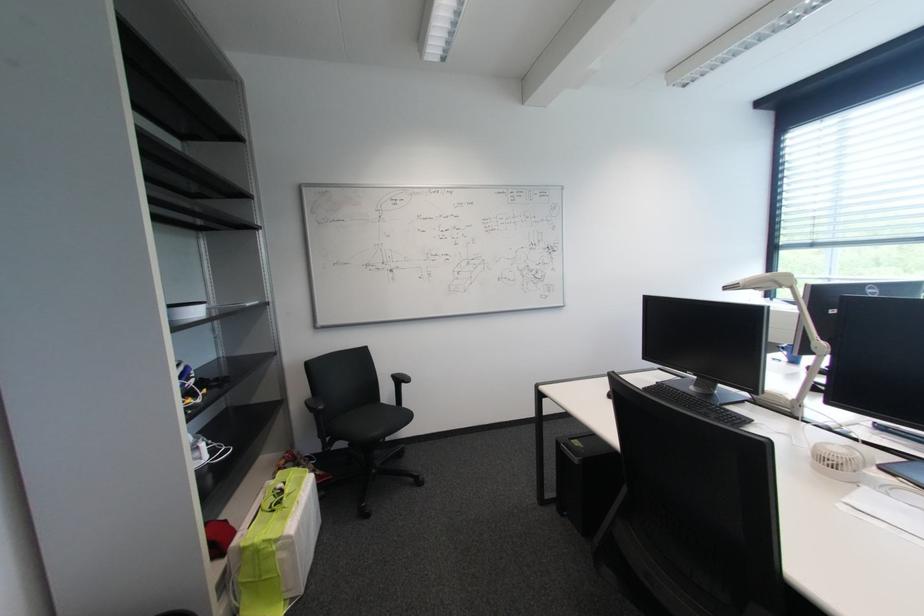
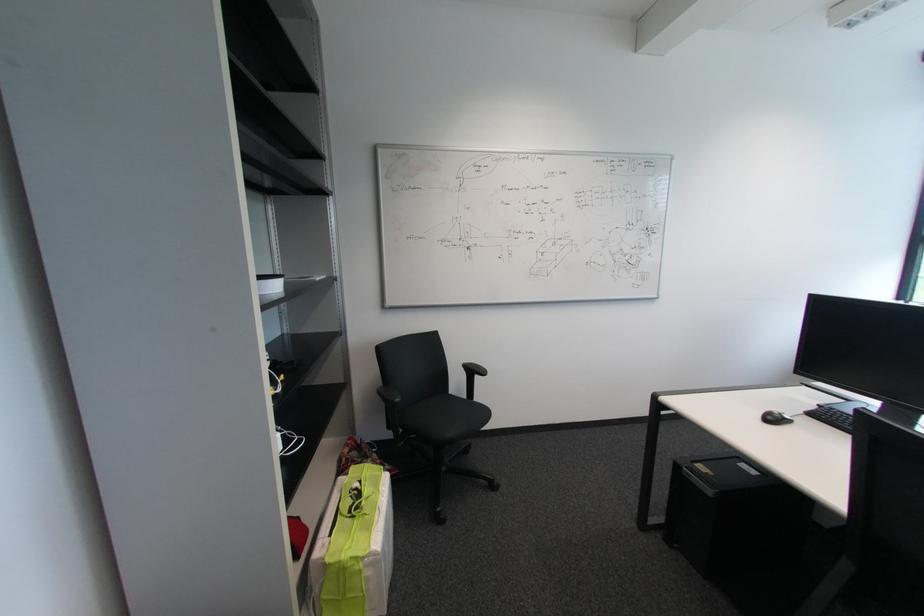
Find the pixel in the second image that matches the point at 271,543 in the first image.

(358, 560)